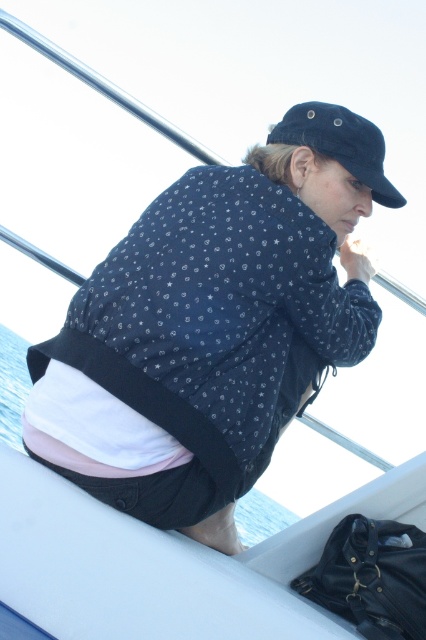
Can you confirm if matte black jacket at center is wider than black matte baseball cap at upper center?

Yes, matte black jacket at center is wider than black matte baseball cap at upper center.

Image resolution: width=426 pixels, height=640 pixels. Describe the element at coordinates (215, 323) in the screenshot. I see `matte black jacket at center` at that location.

Is point (169, 236) positioned in front of point (296, 116)?

Yes, point (169, 236) is closer to viewer.

You are a GUI agent. You are given a task and a screenshot of the screen. Output one action in this format:
    pyautogui.click(x=<x>, y=<y>)
    Task: Click on the matte black jacket at center
    This screenshot has height=640, width=426.
    Given the screenshot: What is the action you would take?
    pyautogui.click(x=215, y=323)

Between black matte baseball cap at upper center and blue water at lower left, which one is positioned higher?

black matte baseball cap at upper center

Find the location of a particular element. This screenshot has height=640, width=426. black matte baseball cap at upper center is located at coordinates (339, 144).

Who is higher up, matte black jacket at center or blue water at lower left?

matte black jacket at center is above.

Does matte black jacket at center have a greater height compared to blue water at lower left?

Incorrect, matte black jacket at center's height is not larger of blue water at lower left's.

Which is behind, point (322, 157) or point (11, 396)?

The point (11, 396) is behind.

Where is `matte black jacket at center`? Image resolution: width=426 pixels, height=640 pixels. matte black jacket at center is located at coordinates (215, 323).